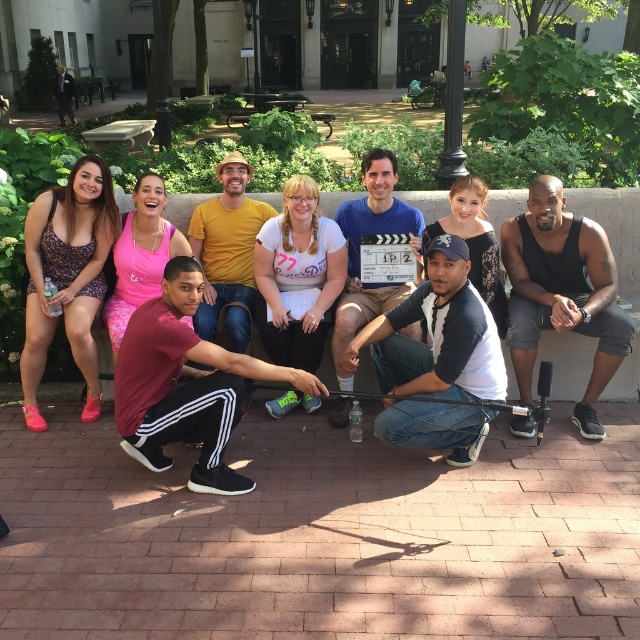
Is maroon fabric pants at lower left wider than matte blue shirt at center?

Yes, maroon fabric pants at lower left is wider than matte blue shirt at center.

Between point (200, 483) and point (355, 307), which one is positioned in front?

Point (200, 483) is more forward.

Image resolution: width=640 pixels, height=640 pixels. Identify the location of maroon fabric pants at lower left. (186, 385).

Is dark gray cotton shirt at center below yellow cotton shirt at center?

Yes.

Who is more distant from viewer, (385, 346) or (198, 317)?

Answer: The point (198, 317) is more distant.

In order to click on dark gray cotton shirt at center in this screenshot , I will do `click(436, 336)`.

Based on the photo, does maroon fabric pants at lower left have a smaller size compared to dark gray cotton shirt at center?

Actually, maroon fabric pants at lower left might be larger than dark gray cotton shirt at center.

Where is `maroon fabric pants at lower left`? maroon fabric pants at lower left is located at coordinates (186, 385).

Is point (301, 387) farther from camera compared to point (432, 326)?

No, it is in front of (432, 326).

The width and height of the screenshot is (640, 640). I want to click on maroon fabric pants at lower left, so (x=186, y=385).